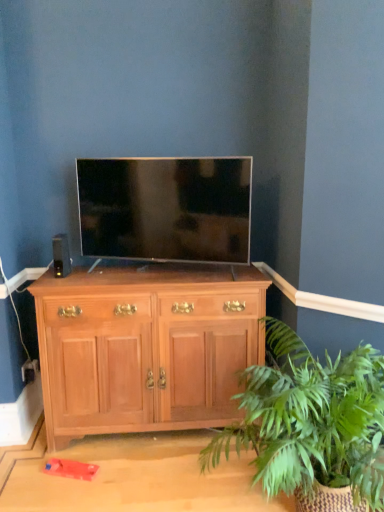
Question: From a real-world perspective, is black matte speaker at left located higher than matte black tv at center?

Choices:
 (A) no
 (B) yes

Answer: (A)

Question: Is black matte speaker at left taller than matte black tv at center?

Choices:
 (A) no
 (B) yes

Answer: (A)

Question: Considering the relative positions of black matte speaker at left and matte black tv at center in the image provided, is black matte speaker at left to the right of matte black tv at center from the viewer's perspective?

Choices:
 (A) yes
 (B) no

Answer: (B)

Question: Is black matte speaker at left aimed at matte black tv at center?

Choices:
 (A) no
 (B) yes

Answer: (A)

Question: Is black matte speaker at left positioned behind matte black tv at center?

Choices:
 (A) no
 (B) yes

Answer: (B)

Question: Is point (188, 351) closer or farther from the camera than point (69, 266)?

Choices:
 (A) closer
 (B) farther

Answer: (A)

Question: From their relative heights in the image, would you say light brown wood cabinet at center is taller or shorter than black matte speaker at left?

Choices:
 (A) tall
 (B) short

Answer: (A)

Question: From a real-world perspective, relative to black matte speaker at left, is light brown wood cabinet at center vertically above or below?

Choices:
 (A) above
 (B) below

Answer: (B)

Question: Would you say light brown wood cabinet at center is to the left or to the right of black matte speaker at left in the picture?

Choices:
 (A) left
 (B) right

Answer: (B)

Question: Does point (57, 237) appear closer or farther from the camera than point (365, 352)?

Choices:
 (A) farther
 (B) closer

Answer: (A)

Question: Is black matte speaker at left taller or shorter than green leafy plant at lower right?

Choices:
 (A) tall
 (B) short

Answer: (B)

Question: Considering the positions of black matte speaker at left and green leafy plant at lower right in the image, is black matte speaker at left bigger or smaller than green leafy plant at lower right?

Choices:
 (A) small
 (B) big

Answer: (A)

Question: Is black matte speaker at left wider or thinner than green leafy plant at lower right?

Choices:
 (A) thin
 (B) wide

Answer: (A)

Question: In terms of size, does green leafy plant at lower right appear bigger or smaller than black matte speaker at left?

Choices:
 (A) big
 (B) small

Answer: (A)

Question: Considering the relative positions of green leafy plant at lower right and black matte speaker at left in the image provided, is green leafy plant at lower right to the left or to the right of black matte speaker at left?

Choices:
 (A) right
 (B) left

Answer: (A)